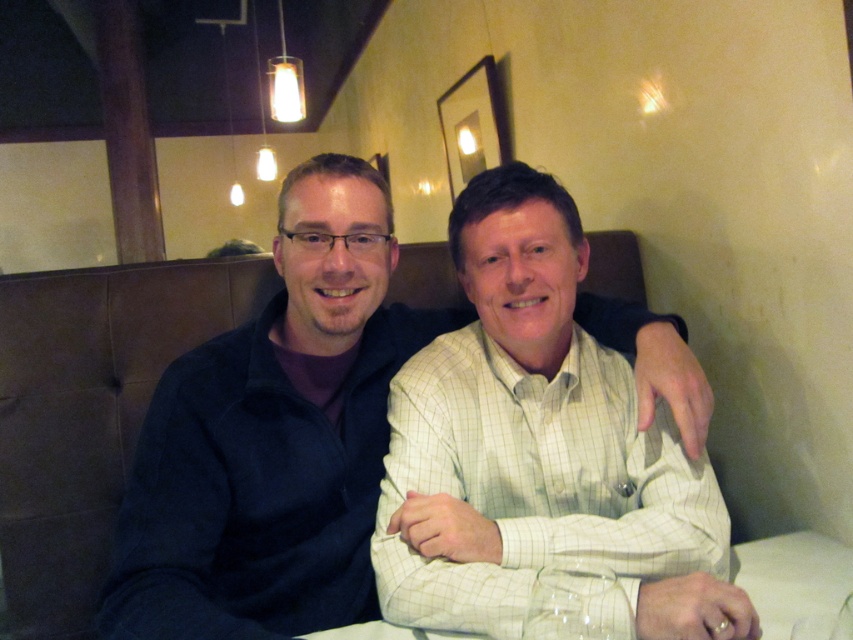
Question: Does clear glass table at center lie behind clear glass wine glass at lower center?

Choices:
 (A) yes
 (B) no

Answer: (A)

Question: Which point is closer to the camera?

Choices:
 (A) clear glass table at center
 (B) light green checkered shirt at center
 (C) clear glass wine glass at lower center

Answer: (C)

Question: In this image, where is clear glass table at center located relative to clear glass wine glass at lower center?

Choices:
 (A) below
 (B) above

Answer: (A)

Question: Observing the image, what is the correct spatial positioning of light green checkered shirt at center in reference to clear glass wine glass at lower center?

Choices:
 (A) above
 (B) below

Answer: (A)

Question: Which is nearer to the clear glass table at center?

Choices:
 (A) light green checkered shirt at center
 (B) clear glass wine glass at lower center

Answer: (B)

Question: Which is nearer to the clear glass wine glass at lower center?

Choices:
 (A) light green checkered shirt at center
 (B) clear glass table at center

Answer: (A)